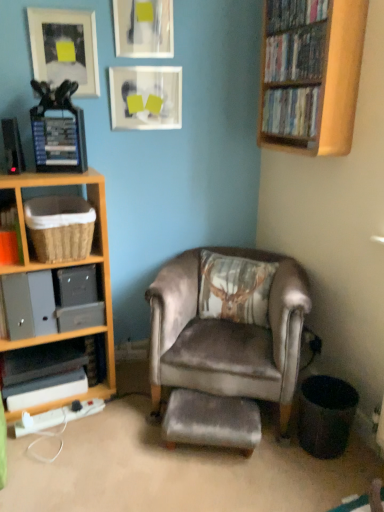
Describe the element at coordinates (226, 342) in the screenshot. I see `velvet brown armchair at center` at that location.

What is the approximate width of wooden shelf at upper right, which is counted as the second book, starting from the bottom?

The width of wooden shelf at upper right, which is counted as the second book, starting from the bottom, is 7.75 inches.

This screenshot has height=512, width=384. Find the location of `woven brown basket at left, which ranks as the 3th shelf in bottom-to-top order`. woven brown basket at left, which ranks as the 3th shelf in bottom-to-top order is located at coordinates (60, 227).

Where is `wooden shelf at left, the 2th shelf ordered from the bottom`? This screenshot has width=384, height=512. wooden shelf at left, the 2th shelf ordered from the bottom is located at coordinates (69, 264).

Does matte glass picture frame at upper center, which is the 2th picture frame in right-to-left order, contain wooden bookshelf at upper right, the first book when ordered from top to bottom?

Definitely not — wooden bookshelf at upper right, the first book when ordered from top to bottom, is not inside matte glass picture frame at upper center, which is the 2th picture frame in right-to-left order.

Is the depth of matte glass picture frame at upper center, placed as the 2th picture frame when sorted from left to right, less than that of wooden bookshelf at upper right, the third book when ordered from bottom to top?

No, matte glass picture frame at upper center, placed as the 2th picture frame when sorted from left to right, is behind wooden bookshelf at upper right, the third book when ordered from bottom to top.

Considering the points (157, 39) and (319, 2), which point is in front, point (157, 39) or point (319, 2)?

The point (319, 2) is more forward.

Based on the photo, from the image's perspective, is woven brown basket at left, the first shelf in the top-to-bottom sequence, located above or below wooden bookshelf at upper right, the first book when ordered from top to bottom?

woven brown basket at left, the first shelf in the top-to-bottom sequence, is situated lower than wooden bookshelf at upper right, the first book when ordered from top to bottom, in the image.

Starting from the woven brown basket at left, the first shelf in the top-to-bottom sequence, which book is the 2nd one in front? Please provide its 2D coordinates.

[(294, 13)]

Which object is positioned more to the right, woven brown basket at left, the first shelf in the top-to-bottom sequence, or wooden bookshelf at upper right, the first book when ordered from top to bottom?

wooden bookshelf at upper right, the first book when ordered from top to bottom, is more to the right.

Which point is more forward, (x=25, y=218) or (x=311, y=22)?

Point (x=311, y=22)

Does matte black books at left, the 3th shelf in the top-to-bottom sequence, turn towards wooden bookshelf at upper right?

No, matte black books at left, the 3th shelf in the top-to-bottom sequence, is not oriented towards wooden bookshelf at upper right.

Is matte black books at left, the 3th shelf in the top-to-bottom sequence, shorter than wooden bookshelf at upper right?

Yes, matte black books at left, the 3th shelf in the top-to-bottom sequence, is shorter than wooden bookshelf at upper right.

Which is in front, matte black books at left, marked as the first shelf in a bottom-to-top arrangement, or wooden bookshelf at upper right?

wooden bookshelf at upper right.

Between matte black books at left, marked as the first shelf in a bottom-to-top arrangement, and wooden bookshelf at upper right, which one has larger width?

matte black books at left, marked as the first shelf in a bottom-to-top arrangement.

Where is `chair on the right of woven brown basket at left, the first shelf in the top-to-bottom sequence`? chair on the right of woven brown basket at left, the first shelf in the top-to-bottom sequence is located at coordinates 226,342.

Choose the correct answer: Is woven brown basket at left, which ranks as the 3th shelf in bottom-to-top order, inside velvet brown armchair at center or outside it?

woven brown basket at left, which ranks as the 3th shelf in bottom-to-top order, lies outside velvet brown armchair at center.

Can you confirm if woven brown basket at left, the first shelf in the top-to-bottom sequence, is thinner than velvet brown armchair at center?

Yes.

Considering the positions of objects woven brown basket at left, the first shelf in the top-to-bottom sequence, and velvet brown armchair at center in the image provided, who is behind, woven brown basket at left, the first shelf in the top-to-bottom sequence, or velvet brown armchair at center?

woven brown basket at left, the first shelf in the top-to-bottom sequence.

Is wooden bookshelf at upper right with velvet brown pillow at center?

wooden bookshelf at upper right and velvet brown pillow at center are not in contact.

From the image's perspective, would you say wooden bookshelf at upper right is shown under velvet brown pillow at center?

Incorrect, from the image's perspective, wooden bookshelf at upper right is higher than velvet brown pillow at center.

Is wooden bookshelf at upper right at the left side of velvet brown pillow at center?

No.

Considering the sizes of objects velvet brown armchair at center and matte plastic dvds at upper right, the 1th book positioned from the bottom, in the image provided, who is bigger, velvet brown armchair at center or matte plastic dvds at upper right, the 1th book positioned from the bottom,?

With larger size is velvet brown armchair at center.

In the scene shown: Who is more distant, velvet brown armchair at center or matte plastic dvds at upper right, the 1th book positioned from the bottom?

matte plastic dvds at upper right, the 1th book positioned from the bottom, is behind.

From the image's perspective, which is below, velvet brown armchair at center or matte plastic dvds at upper right, the 1th book positioned from the bottom?

velvet brown armchair at center appears lower in the image.

Which point is more distant from viewer, (300,318) or (288,129)?

The point (288,129) is behind.

From a real-world perspective, which object stands above the other?

From a 3D spatial view, wooden shelf at upper right, which is counted as the second book, starting from the bottom, is above.

In the scene shown: How different are the orientations of velvet brown armchair at center and wooden shelf at upper right, which is counted as the second book, starting from the bottom, in degrees?

The facing directions of velvet brown armchair at center and wooden shelf at upper right, which is counted as the second book, starting from the bottom, are 57.4 degrees apart.

Is velvet brown armchair at center further to the viewer compared to wooden shelf at upper right, which is counted as the second book, starting from the bottom?

That is True.

Considering the relative sizes of velvet brown armchair at center and wooden shelf at upper right, which is counted as the second book, starting from the top, in the image provided, is velvet brown armchair at center thinner than wooden shelf at upper right, which is counted as the second book, starting from the top,?

No, velvet brown armchair at center is not thinner than wooden shelf at upper right, which is counted as the second book, starting from the top.

Where is `the 2nd picture frame behind the wooden bookshelf at upper right, the first book when ordered from top to bottom, starting your count from the anchor`? The image size is (384, 512). the 2nd picture frame behind the wooden bookshelf at upper right, the first book when ordered from top to bottom, starting your count from the anchor is located at coordinates (144, 28).

In order to click on the 3rd book positioned above the woven brown basket at left, the first shelf in the top-to-bottom sequence (from the image's perspective) in this screenshot , I will do `click(294, 13)`.

Based on their spatial positions, is velvet grey footrest at center or wooden shelf at upper right, which is counted as the second book, starting from the top, closer to wooden bookshelf at upper right?

Based on the image, wooden shelf at upper right, which is counted as the second book, starting from the top, appears to be nearer to wooden bookshelf at upper right.

From the image, which object appears to be farther from velvet grey footrest at center, matte black picture frame at upper left, placed as the third picture frame when sorted from right to left, or wooden bookshelf at upper right, the third book when ordered from bottom to top?

wooden bookshelf at upper right, the third book when ordered from bottom to top.

Considering their positions, is wooden shelf at left, the 2th shelf ordered from the bottom, positioned further to velvet brown armchair at center than wooden bookshelf at upper right?

The object further to velvet brown armchair at center is wooden bookshelf at upper right.

From the image, which object appears to be farther from wooden bookshelf at upper right, matte plastic dvds at upper right, which ranks as the third book in top-to-bottom order, or velvet grey footrest at center?

velvet grey footrest at center.

Looking at the image, which one is located closer to velvet brown pillow at center, wooden shelf at left, positioned as the second shelf in top-to-bottom order, or matte glass picture frame at upper center, placed as the 2th picture frame when sorted from left to right?

wooden shelf at left, positioned as the second shelf in top-to-bottom order, is closer to velvet brown pillow at center.

From the image, which object appears to be nearer to wooden shelf at left, the 2th shelf ordered from the bottom, matte glass picture frame at upper center, the first picture frame when ordered from right to left, or matte plastic dvds at upper right, which ranks as the third book in top-to-bottom order?

The object closer to wooden shelf at left, the 2th shelf ordered from the bottom, is matte glass picture frame at upper center, the first picture frame when ordered from right to left.

Based on their spatial positions, is wooden bookshelf at upper right, the third book when ordered from bottom to top, or woven brown basket at left, the first shelf in the top-to-bottom sequence, closer to velvet grey footrest at center?

Among the two, woven brown basket at left, the first shelf in the top-to-bottom sequence, is located nearer to velvet grey footrest at center.

Which object lies further to the anchor point woven brown basket at left, the first shelf in the top-to-bottom sequence, wooden shelf at left, positioned as the second shelf in top-to-bottom order, or matte glass picture frame at upper center, placed as the 2th picture frame when sorted from left to right?

Among the two, matte glass picture frame at upper center, placed as the 2th picture frame when sorted from left to right, is located further to woven brown basket at left, the first shelf in the top-to-bottom sequence.

The image size is (384, 512). Find the location of `book between matte glass picture frame at upper center, which ranks as the third picture frame in left-to-right order, and matte black books at left, the 3th shelf in the top-to-bottom sequence, from top to bottom`. book between matte glass picture frame at upper center, which ranks as the third picture frame in left-to-right order, and matte black books at left, the 3th shelf in the top-to-bottom sequence, from top to bottom is located at coordinates (291, 111).

In order to click on pillow between matte black picture frame at upper left, placed as the third picture frame when sorted from right to left, and velvet brown armchair at center from top to bottom in this screenshot , I will do `click(235, 288)`.

Identify the location of picture frame situated between matte black picture frame at upper left, placed as the 1th picture frame when sorted from left to right, and matte glass picture frame at upper center, which ranks as the third picture frame in left-to-right order, from left to right. (144, 28).

You are a GUI agent. You are given a task and a screenshot of the screen. Output one action in this format:
    pyautogui.click(x=<x>, y=<y>)
    Task: Click on the bookcase between wooden shelf at upper right, which is counted as the second book, starting from the top, and velvet grey footrest at center vertically
    
    Given the screenshot: What is the action you would take?
    pyautogui.click(x=310, y=74)